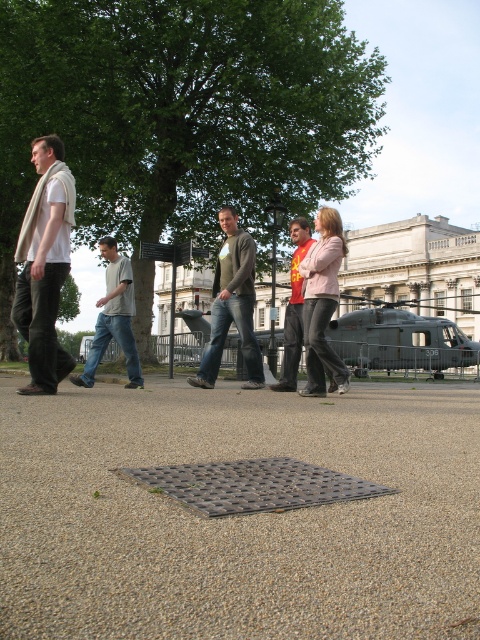
The group of five individuals is walking on a paved area near a historical building. There is a textured metal grate in the foreground and a dark gray concrete helicopter at center represented by point (x=418, y=268). Which object is closer to the group, the textured metal grate or the dark gray concrete helicopter?

The textured metal grate is closer to the group because it is in the foreground, while the dark gray concrete helicopter at center is further away.

You are standing at the point marked as point (239, 516). What object is exactly at that coordinate?

The gray textured pavement at center is located at point (239, 516).